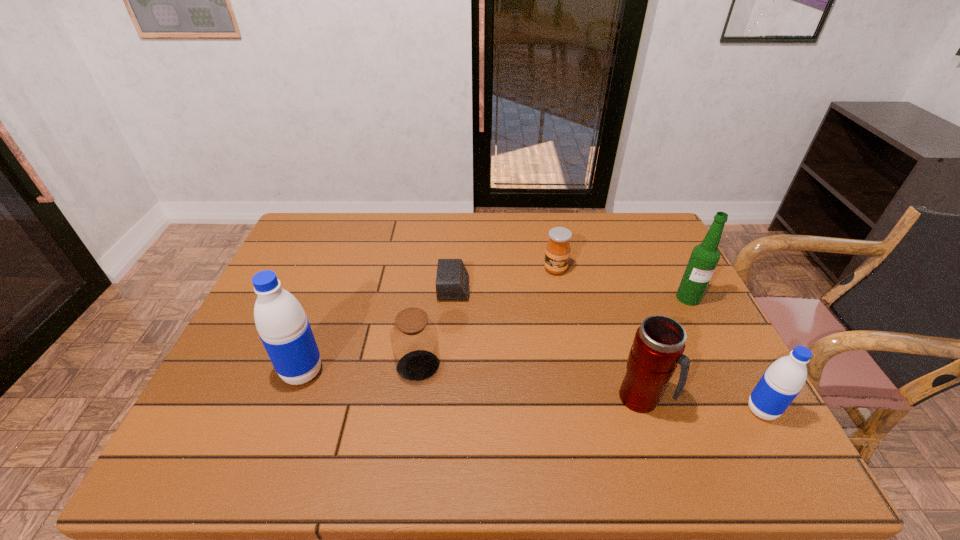
The height and width of the screenshot is (540, 960). Identify the location of beer bottle that is at the right edge. (704, 258).

This screenshot has height=540, width=960. In order to click on object that is at the near left corner in this screenshot , I will do `click(284, 329)`.

Image resolution: width=960 pixels, height=540 pixels. I want to click on object located at the near right corner, so click(x=780, y=384).

The image size is (960, 540). In the image, there is a desktop. What are the coordinates of `free space at the far edge` in the screenshot? It's located at click(x=476, y=219).

In the image, there is a desktop. Identify the location of free region at the near edge. The height and width of the screenshot is (540, 960). (449, 420).

Image resolution: width=960 pixels, height=540 pixels. Find the location of `free space at the left edge of the desktop`. free space at the left edge of the desktop is located at coordinates (302, 274).

You are a GUI agent. You are given a task and a screenshot of the screen. Output one action in this format:
    pyautogui.click(x=<x>, y=<y>)
    Task: Click on the vacant space at the right edge of the desktop
    The height and width of the screenshot is (540, 960).
    Given the screenshot: What is the action you would take?
    pyautogui.click(x=668, y=287)

Identify the location of free space at the far left corner of the desktop. (341, 237).

The width and height of the screenshot is (960, 540). In the image, there is a desktop. Find the location of `vacant space at the far right corner`. vacant space at the far right corner is located at coordinates (623, 235).

Where is `free space between the beer bottle and the farther water bottle`? Image resolution: width=960 pixels, height=540 pixels. free space between the beer bottle and the farther water bottle is located at coordinates (495, 335).